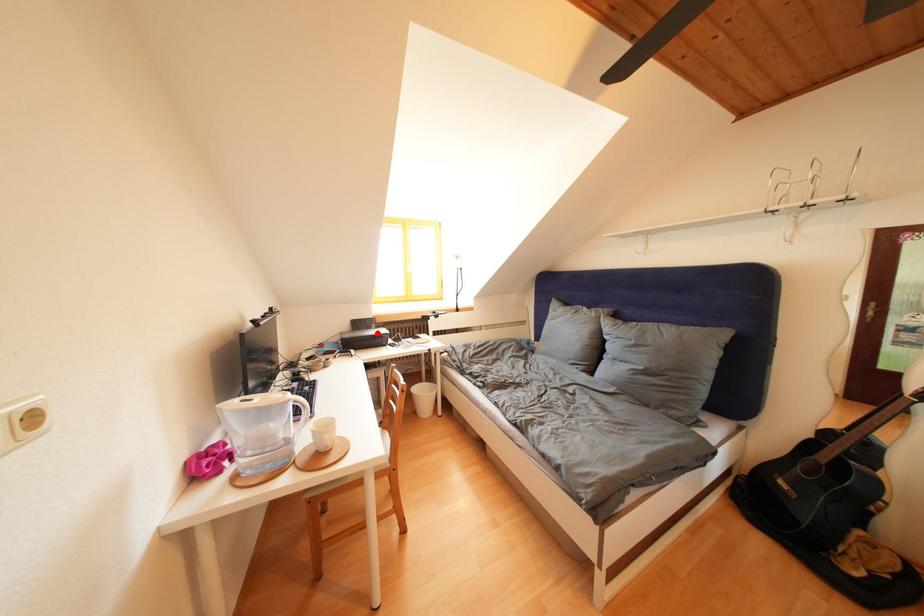
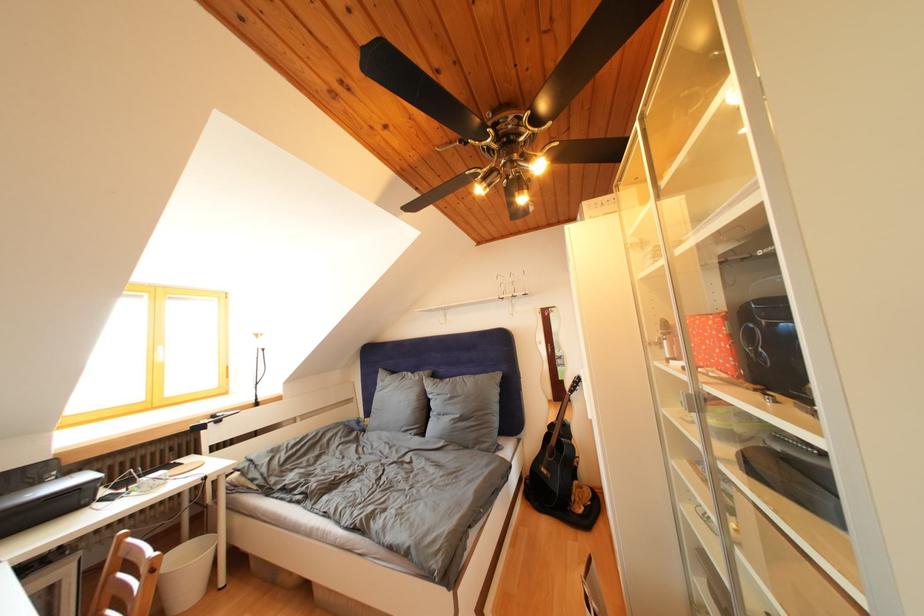
Question: I am providing you with two images of the same scene from different viewpoints. A red point is marked on the first image. Can you still see the location of the red point in image 2?

Choices:
 (A) Yes
 (B) No

Answer: (A)